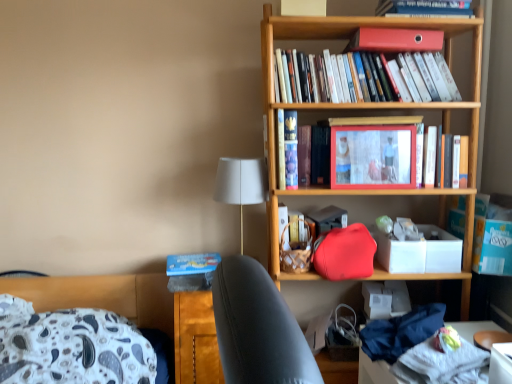
Question: Does white matte box at center-right come behind matte plastic picture frame at center?

Choices:
 (A) yes
 (B) no

Answer: (A)

Question: Does white matte box at center-right have a smaller size compared to matte plastic picture frame at center?

Choices:
 (A) no
 (B) yes

Answer: (A)

Question: Can you confirm if white matte box at center-right is positioned to the left of matte plastic picture frame at center?

Choices:
 (A) yes
 (B) no

Answer: (B)

Question: Is white matte box at center-right far from matte plastic picture frame at center?

Choices:
 (A) yes
 (B) no

Answer: (B)

Question: Does white matte box at center-right turn towards matte plastic picture frame at center?

Choices:
 (A) yes
 (B) no

Answer: (B)

Question: From a real-world perspective, is blue matte paperback book at lower left, which ranks as the 2th paperback book in front-to-back order, above or below matte plastic picture frame at center?

Choices:
 (A) above
 (B) below

Answer: (B)

Question: In terms of width, does blue matte paperback book at lower left, the 2th paperback book positioned from the top, look wider or thinner when compared to matte plastic picture frame at center?

Choices:
 (A) wide
 (B) thin

Answer: (A)

Question: Is blue matte paperback book at lower left, acting as the second paperback book starting from the right, taller or shorter than matte plastic picture frame at center?

Choices:
 (A) tall
 (B) short

Answer: (B)

Question: Choose the correct answer: Is blue matte paperback book at lower left, the first paperback book in the back-to-front sequence, inside matte plastic picture frame at center or outside it?

Choices:
 (A) inside
 (B) outside

Answer: (B)

Question: Based on their sizes in the image, would you say white matte box at center-right is bigger or smaller than matte plastic picture frame at center?

Choices:
 (A) big
 (B) small

Answer: (A)

Question: Is white matte box at center-right wider or thinner than matte plastic picture frame at center?

Choices:
 (A) wide
 (B) thin

Answer: (A)

Question: Would you say white matte box at center-right is to the left or to the right of matte plastic picture frame at center in the picture?

Choices:
 (A) right
 (B) left

Answer: (A)

Question: From a real-world perspective, is white matte box at center-right positioned above or below matte plastic picture frame at center?

Choices:
 (A) below
 (B) above

Answer: (A)

Question: Is hardcover book at center, the first book in the bottom-to-top sequence, to the left or to the right of matte plastic picture frame at center in the image?

Choices:
 (A) left
 (B) right

Answer: (B)

Question: Considering the positions of point (437, 142) and point (404, 183), is point (437, 142) closer or farther from the camera than point (404, 183)?

Choices:
 (A) farther
 (B) closer

Answer: (A)